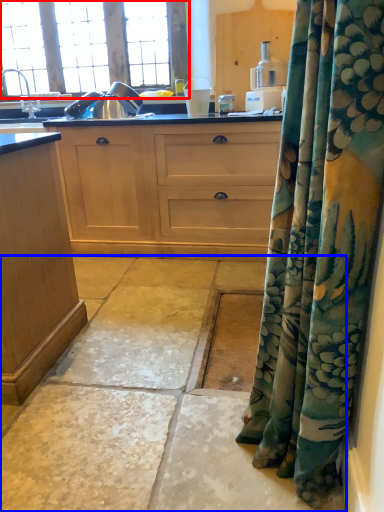
Question: Which of the following is the farthest to the observer, window (highlighted by a red box) or concrete (highlighted by a blue box)?

Choices:
 (A) window
 (B) concrete

Answer: (A)